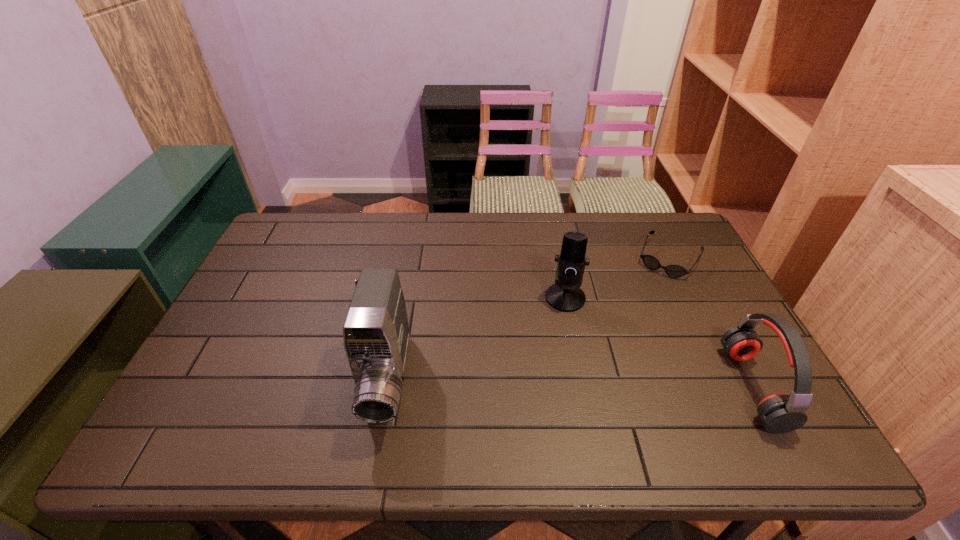
In order to click on vacant area in the image that satisfies the following two spatial constraints: 1. at the front of the camcorder, highlighting the lens; 2. on the ear cups of the earphone in this screenshot , I will do `click(386, 387)`.

Locate an element on the screen. free space in the image that satisfies the following two spatial constraints: 1. at the front of the earphone, highlighting the lens; 2. on the ear cups of the leftmost object is located at coordinates (386, 387).

Image resolution: width=960 pixels, height=540 pixels. I want to click on vacant space that satisfies the following two spatial constraints: 1. at the front of the earphone, highlighting the lens; 2. on the ear cups of the camcorder, so click(x=386, y=387).

Where is `free location that satisfies the following two spatial constraints: 1. at the front of the earphone, highlighting the lens; 2. on the ear cups of the leftmost object`? free location that satisfies the following two spatial constraints: 1. at the front of the earphone, highlighting the lens; 2. on the ear cups of the leftmost object is located at coordinates (386, 387).

This screenshot has width=960, height=540. In order to click on free space that satisfies the following two spatial constraints: 1. on the front side of the earphone; 2. on the ear cups of the microphone in this screenshot , I will do `click(584, 387)`.